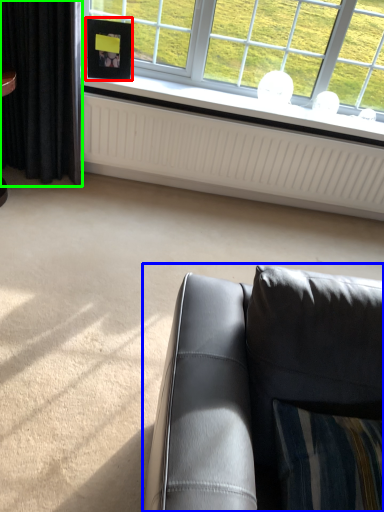
Question: Estimate the real-world distances between objects in this image. Which object is farther from picture frame (highlighted by a red box), studio couch (highlighted by a blue box) or curtain (highlighted by a green box)?

Choices:
 (A) studio couch
 (B) curtain

Answer: (A)